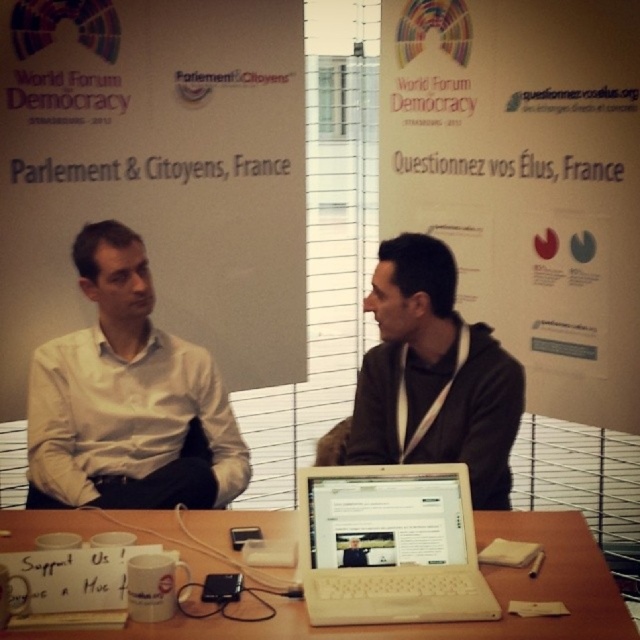
Question: Is the position of white paper at center more distant than that of white shirt at center?

Choices:
 (A) no
 (B) yes

Answer: (B)

Question: Is white paper at upper center above white matte coffee cup at lower center?

Choices:
 (A) yes
 (B) no

Answer: (A)

Question: Which object is farther from the camera taking this photo?

Choices:
 (A) white matte coffee cup at lower center
 (B) white plastic laptop at center

Answer: (A)

Question: Among these objects, which one is nearest to the camera?

Choices:
 (A) white shirt at center
 (B) white paper at center
 (C) white paper at upper center

Answer: (A)

Question: Is white paper at center smaller than white shirt at center?

Choices:
 (A) no
 (B) yes

Answer: (A)

Question: Which of these objects is positioned closest to the white paper at upper center?

Choices:
 (A) matte black hoodie at center
 (B) white matte coffee cup at lower center

Answer: (A)